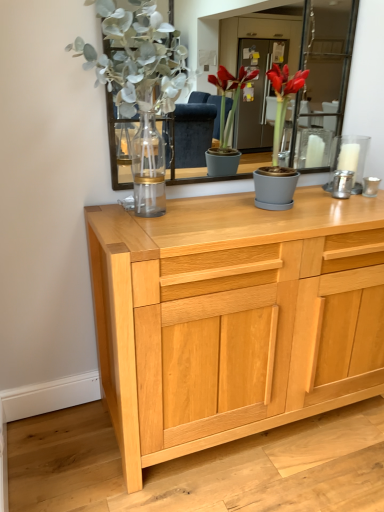
Question: Can you confirm if matte gray pot at center is wider than matte glass vase at upper left?

Choices:
 (A) yes
 (B) no

Answer: (B)

Question: Is matte gray pot at center thinner than matte glass vase at upper left?

Choices:
 (A) no
 (B) yes

Answer: (B)

Question: Can you confirm if matte gray pot at center is bigger than matte glass vase at upper left?

Choices:
 (A) yes
 (B) no

Answer: (B)

Question: From a real-world perspective, is matte gray pot at center under matte glass vase at upper left?

Choices:
 (A) yes
 (B) no

Answer: (A)

Question: Does matte gray pot at center touch matte glass vase at upper left?

Choices:
 (A) yes
 (B) no

Answer: (B)

Question: Is the position of matte gray pot at center more distant than that of matte glass vase at upper left?

Choices:
 (A) yes
 (B) no

Answer: (A)

Question: Considering the relative sizes of matte gray pot at center and silver metallic candle holder at right in the image provided, is matte gray pot at center taller than silver metallic candle holder at right?

Choices:
 (A) no
 (B) yes

Answer: (B)

Question: Is matte gray pot at center at the right side of silver metallic candle holder at right?

Choices:
 (A) yes
 (B) no

Answer: (B)

Question: From a real-world perspective, is matte gray pot at center beneath silver metallic candle holder at right?

Choices:
 (A) yes
 (B) no

Answer: (B)

Question: Is silver metallic candle holder at right completely or partially inside matte gray pot at center?

Choices:
 (A) yes
 (B) no

Answer: (B)

Question: From a real-world perspective, is matte gray pot at center physically above silver metallic candle holder at right?

Choices:
 (A) yes
 (B) no

Answer: (A)

Question: From the image's perspective, is matte gray pot at center under silver metallic candle holder at right?

Choices:
 (A) yes
 (B) no

Answer: (B)

Question: Is silver metallic candle holder at right closer to camera compared to matte gray pot at center?

Choices:
 (A) yes
 (B) no

Answer: (B)